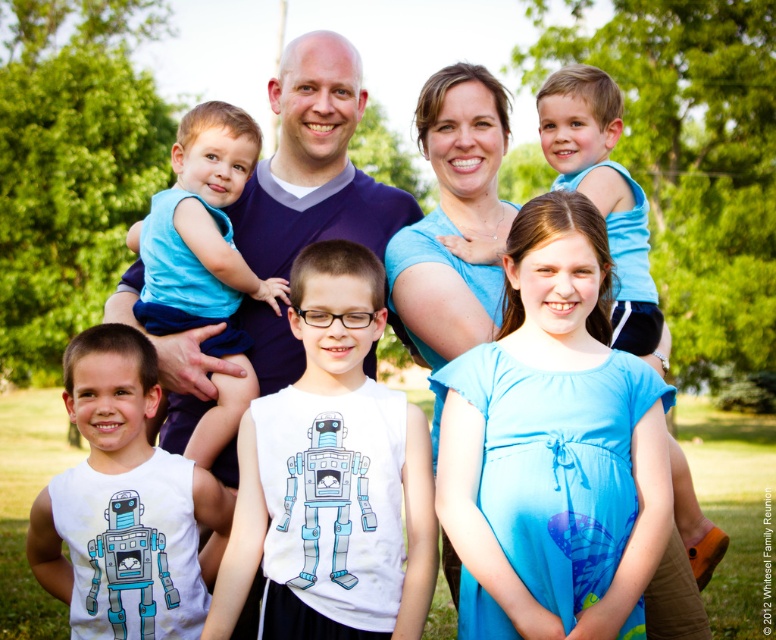
Is white matte robot shirt at lower left bigger than light blue fabric shirt at upper right?

Actually, white matte robot shirt at lower left might be smaller than light blue fabric shirt at upper right.

Who is positioned more to the right, white matte robot shirt at lower left or light blue fabric shirt at upper right?

Positioned to the right is light blue fabric shirt at upper right.

Find the location of a particular element. Image resolution: width=776 pixels, height=640 pixels. white matte robot shirt at lower left is located at coordinates (125, 502).

Is white matte tank top at center wider than blue sleeveless shirt at upper left?

Indeed, white matte tank top at center has a greater width compared to blue sleeveless shirt at upper left.

Does white matte tank top at center appear on the right side of blue sleeveless shirt at upper left?

Yes, white matte tank top at center is to the right of blue sleeveless shirt at upper left.

Locate an element on the screen. The width and height of the screenshot is (776, 640). white matte tank top at center is located at coordinates (331, 476).

The width and height of the screenshot is (776, 640). What are the coordinates of `white matte tank top at center` in the screenshot? It's located at (331, 476).

Looking at this image, which is above, blue sleeveless shirt at upper left or light blue fabric shirt at upper right?

blue sleeveless shirt at upper left is above.

Is point (144, 317) behind point (643, 236)?

No.

Who is more distant from viewer, (220, 228) or (674, 445)?

The point (220, 228) is more distant.

Where is `blue sleeveless shirt at upper left`? blue sleeveless shirt at upper left is located at coordinates (203, 259).